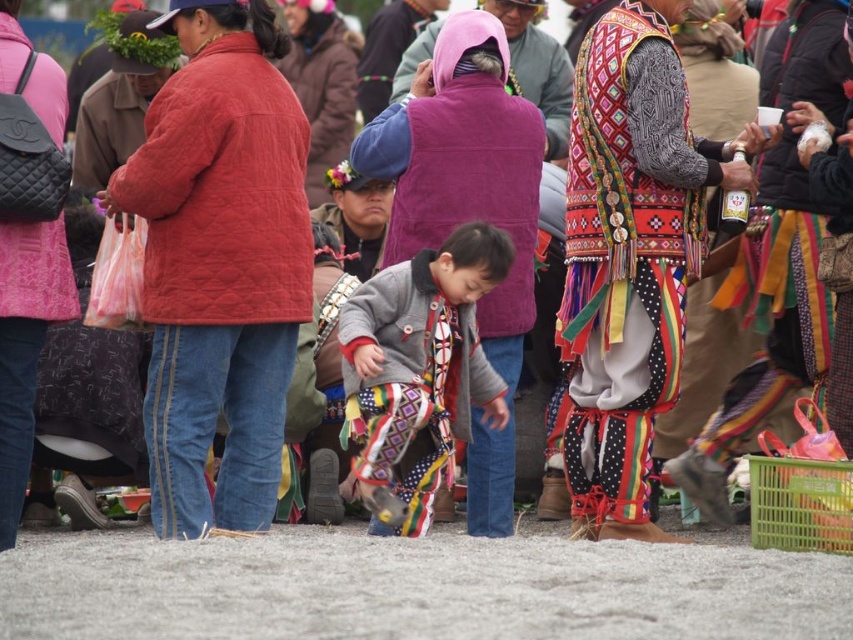
Does quilted red jacket at center have a larger size compared to purple fleece vest at center?

Actually, quilted red jacket at center might be smaller than purple fleece vest at center.

Does point (210, 12) lie in front of point (540, 161)?

Yes, it is in front of point (540, 161).

Locate an element on the screen. quilted red jacket at center is located at coordinates (219, 262).

Does point (627, 492) come behind point (502, 468)?

No.

Is embroidered fabric dress at center to the right of purple fleece vest at center from the viewer's perspective?

Correct, you'll find embroidered fabric dress at center to the right of purple fleece vest at center.

Identify the location of embroidered fabric dress at center. (631, 257).

Is quilted red jacket at center to the left of patterned fabric pants at center from the viewer's perspective?

Indeed, quilted red jacket at center is positioned on the left side of patterned fabric pants at center.

How distant is quilted red jacket at center from patterned fabric pants at center?

A distance of 8.02 meters exists between quilted red jacket at center and patterned fabric pants at center.

Who is more distant from viewer, [158,314] or [419,506]?

The point [419,506] is behind.

Locate an element on the screen. This screenshot has width=853, height=640. quilted red jacket at center is located at coordinates (219, 262).